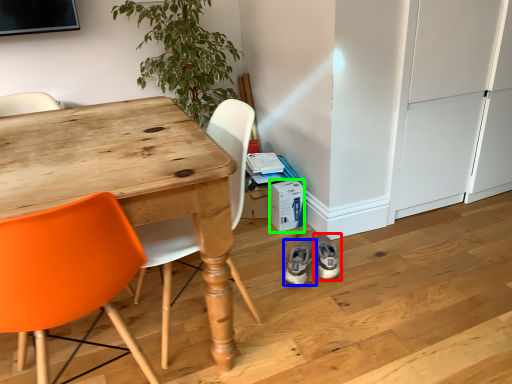
Question: Which is nearer to the footwear (highlighted by a red box)? footwear (highlighted by a blue box) or box (highlighted by a green box).

Choices:
 (A) footwear
 (B) box

Answer: (A)